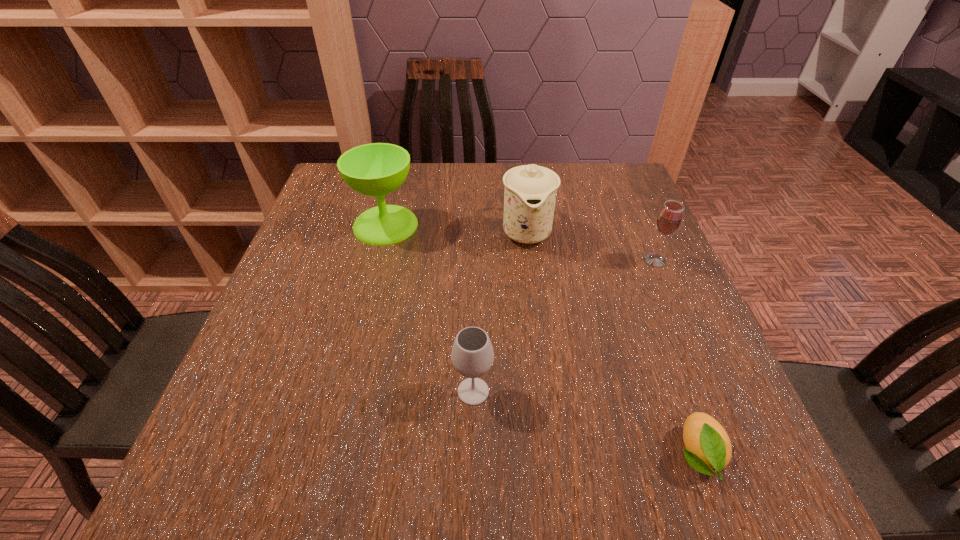
I want to click on free space located on the left of the rightmost wineglass, so click(x=510, y=260).

Find the location of a particular element. This screenshot has height=540, width=960. free region located on the left of the fourth farthest object is located at coordinates (291, 392).

In order to click on chinaware situated at the far edge in this screenshot , I will do `click(530, 192)`.

Where is `wineglass positioned at the far edge`? This screenshot has height=540, width=960. wineglass positioned at the far edge is located at coordinates (376, 169).

The height and width of the screenshot is (540, 960). I want to click on object at the near edge, so click(708, 448).

Where is `object that is positioned at the left edge`? This screenshot has height=540, width=960. object that is positioned at the left edge is located at coordinates (376, 169).

Locate an element on the screen. The width and height of the screenshot is (960, 540). wineglass that is at the right edge is located at coordinates (669, 218).

The height and width of the screenshot is (540, 960). I want to click on lemon situated at the right edge, so click(x=708, y=448).

Where is `object located in the far left corner section of the desktop`? This screenshot has width=960, height=540. object located in the far left corner section of the desktop is located at coordinates (376, 169).

Find the location of a particular element. The image size is (960, 540). object positioned at the near right corner is located at coordinates (708, 448).